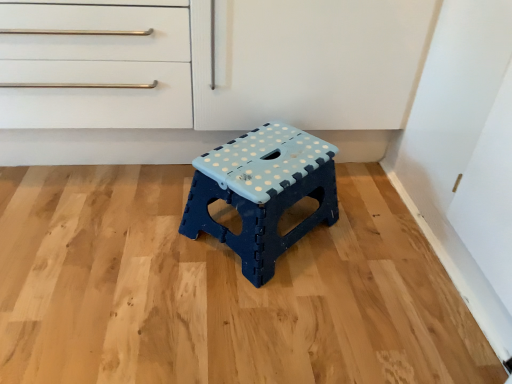
The height and width of the screenshot is (384, 512). I want to click on vacant area on top of blue plastic stool at center (from a real-world perspective), so click(x=262, y=161).